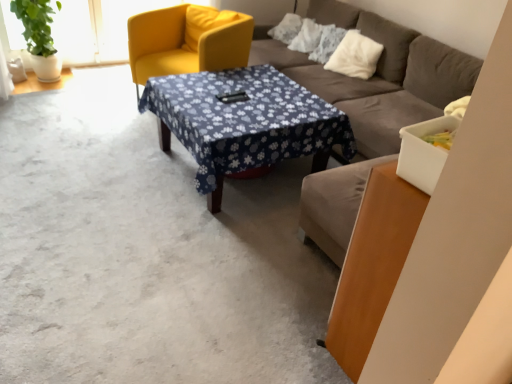
Question: Considering the relative sizes of white fluffy pillow at upper right and matte yellow armchair at upper left in the image provided, is white fluffy pillow at upper right wider than matte yellow armchair at upper left?

Choices:
 (A) yes
 (B) no

Answer: (B)

Question: Does white fluffy pillow at upper right have a lesser height compared to matte yellow armchair at upper left?

Choices:
 (A) yes
 (B) no

Answer: (A)

Question: From the image's perspective, is white fluffy pillow at upper right over matte yellow armchair at upper left?

Choices:
 (A) no
 (B) yes

Answer: (B)

Question: From a real-world perspective, does white fluffy pillow at upper right stand above matte yellow armchair at upper left?

Choices:
 (A) yes
 (B) no

Answer: (A)

Question: From a real-world perspective, is white fluffy pillow at upper right below matte yellow armchair at upper left?

Choices:
 (A) no
 (B) yes

Answer: (A)

Question: Is white fluffy pillow at upper right oriented towards matte yellow armchair at upper left?

Choices:
 (A) no
 (B) yes

Answer: (A)

Question: Can you confirm if blue floral fabric at center is bigger than matte yellow armchair at upper left?

Choices:
 (A) yes
 (B) no

Answer: (B)

Question: Can you confirm if blue floral fabric at center is taller than matte yellow armchair at upper left?

Choices:
 (A) no
 (B) yes

Answer: (A)

Question: Is matte yellow armchair at upper left a part of blue floral fabric at center?

Choices:
 (A) yes
 (B) no

Answer: (B)

Question: From the image's perspective, does blue floral fabric at center appear lower than matte yellow armchair at upper left?

Choices:
 (A) yes
 (B) no

Answer: (A)

Question: From the image's perspective, is blue floral fabric at center on matte yellow armchair at upper left?

Choices:
 (A) no
 (B) yes

Answer: (A)

Question: Does blue floral fabric at center lie behind matte yellow armchair at upper left?

Choices:
 (A) yes
 (B) no

Answer: (B)

Question: From a real-world perspective, is matte yellow armchair at upper left physically below blue floral fabric at center?

Choices:
 (A) yes
 (B) no

Answer: (B)